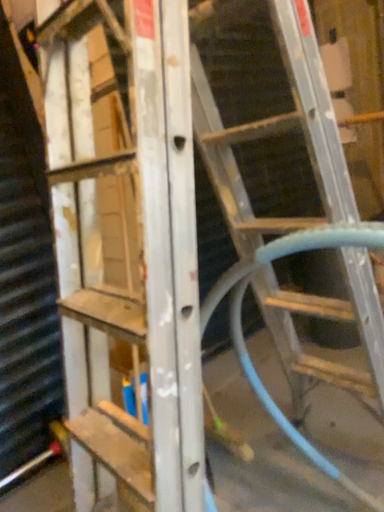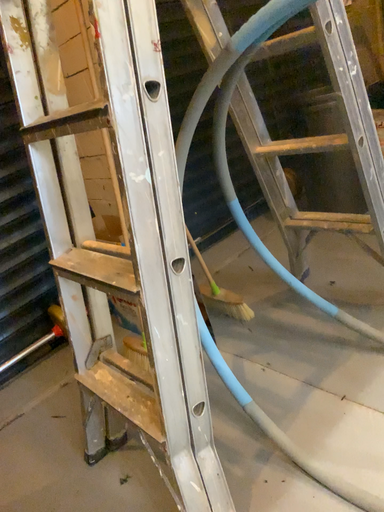
Question: How did the camera likely rotate when shooting the video?

Choices:
 (A) rotated downward
 (B) rotated upward

Answer: (A)